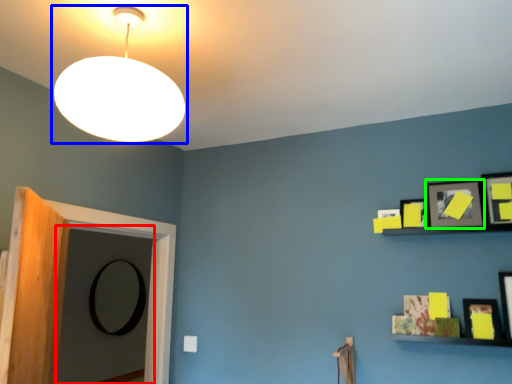
Question: Considering the real-world distances, which object is closest to door (highlighted by a red box)? lamp (highlighted by a blue box) or picture frame (highlighted by a green box).

Choices:
 (A) lamp
 (B) picture frame

Answer: (A)